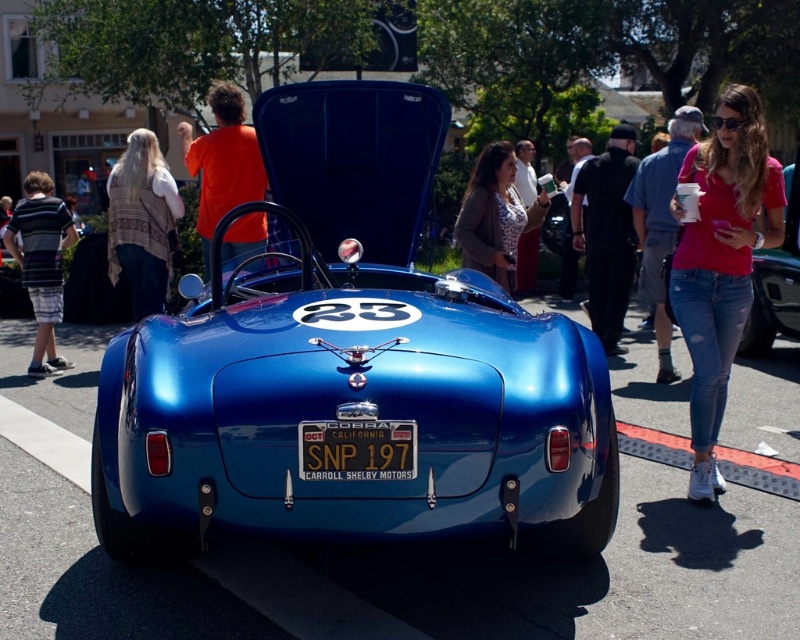
Question: Which object is farther from the camera taking this photo?

Choices:
 (A) metallic blue car at center
 (B) matte brown jacket at center

Answer: (A)

Question: Among these objects, which one is nearest to the camera?

Choices:
 (A) striped fabric shorts at left
 (B) black leather jacket at center

Answer: (B)

Question: In this image, where is knitted beige shawl at left located relative to striped fabric shorts at left?

Choices:
 (A) above
 (B) below

Answer: (A)

Question: Where is black leather jacket at center located in relation to metallic blue license plate at center in the image?

Choices:
 (A) below
 (B) above

Answer: (B)

Question: Is knitted beige shawl at left further to camera compared to metallic blue car at center?

Choices:
 (A) no
 (B) yes

Answer: (B)

Question: Which point is farther to the camera?

Choices:
 (A) pink cotton shirt at right
 (B) metallic blue license plate at center
 (C) knitted beige shawl at left
 (D) black leather jacket at center

Answer: (D)